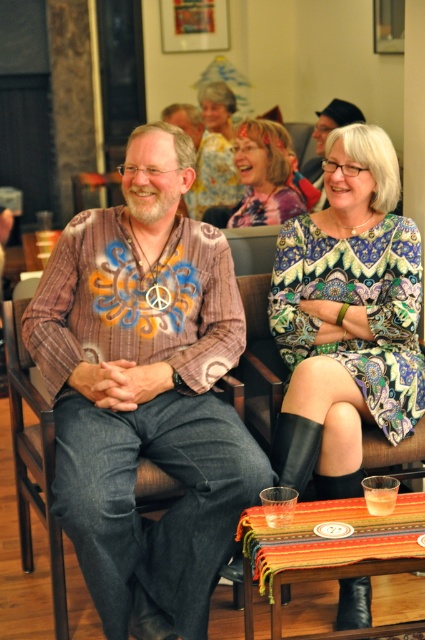
Does multicolored printed dress at center have a larger size compared to matte yellow blouse at upper center?

Actually, multicolored printed dress at center might be smaller than matte yellow blouse at upper center.

Does point (248, 173) come farther from viewer compared to point (217, 156)?

That is False.

At what (x,y) coordinates should I click in order to perform the action: click on multicolored printed dress at center. Please return your answer as a coordinate pair (x, y). The width and height of the screenshot is (425, 640). Looking at the image, I should click on (265, 173).

You are a GUI agent. You are given a task and a screenshot of the screen. Output one action in this format:
    pyautogui.click(x=<x>, y=<y>)
    Task: Click on the printed fabric dress at center
    
    Given the screenshot: What is the action you would take?
    pyautogui.click(x=346, y=317)

Does printed fabric dress at center appear over multicolored printed dress at center?

No.

Is point (370, 394) positioned before point (254, 128)?

Yes, point (370, 394) is closer to viewer.

You are a GUI agent. You are given a task and a screenshot of the screen. Output one action in this format:
    pyautogui.click(x=<x>, y=<y>)
    Task: Click on the printed fabric dress at center
    Image resolution: width=425 pixels, height=640 pixels.
    Given the screenshot: What is the action you would take?
    pyautogui.click(x=346, y=317)

Is point (215, 412) positioned before point (187, 200)?

Yes.

Which of these two, printed cotton shirt at center or matte yellow blouse at upper center, stands taller?

printed cotton shirt at center

What do you see at coordinates (146, 394) in the screenshot? I see `printed cotton shirt at center` at bounding box center [146, 394].

This screenshot has width=425, height=640. Identify the location of printed cotton shirt at center. click(146, 394).